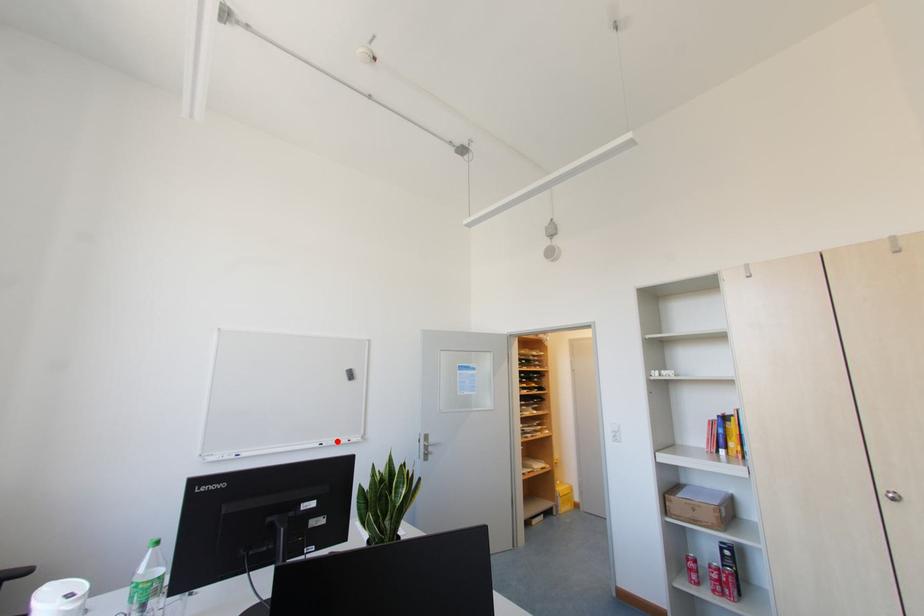
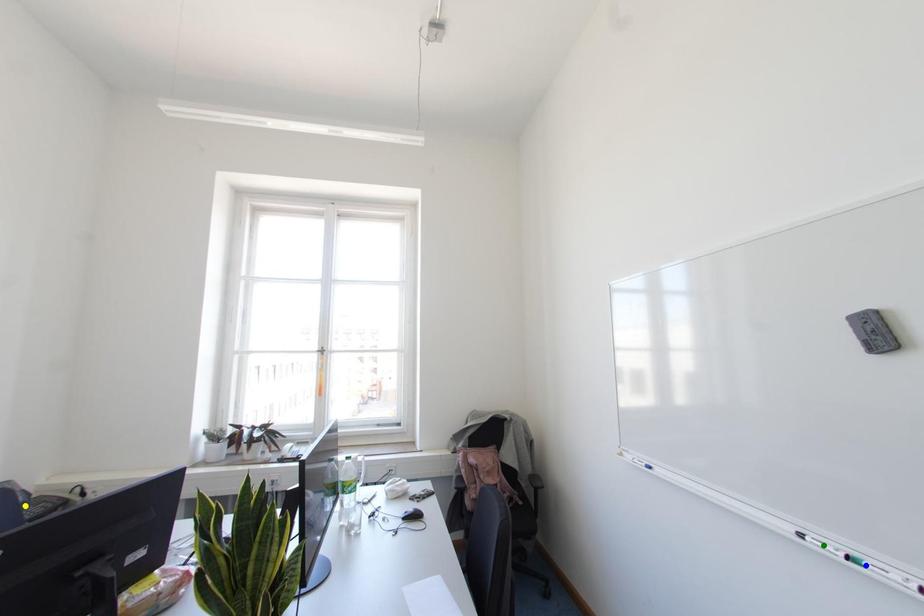
Question: I am providing you with two images of the same scene from different viewpoints. A red point is marked on the first image. You are given multiple points on the second image. Which point in image 2 represents the same 3d spot as the red point in image 1?

Choices:
 (A) green point
 (B) blue point
 (C) yellow point

Answer: (B)